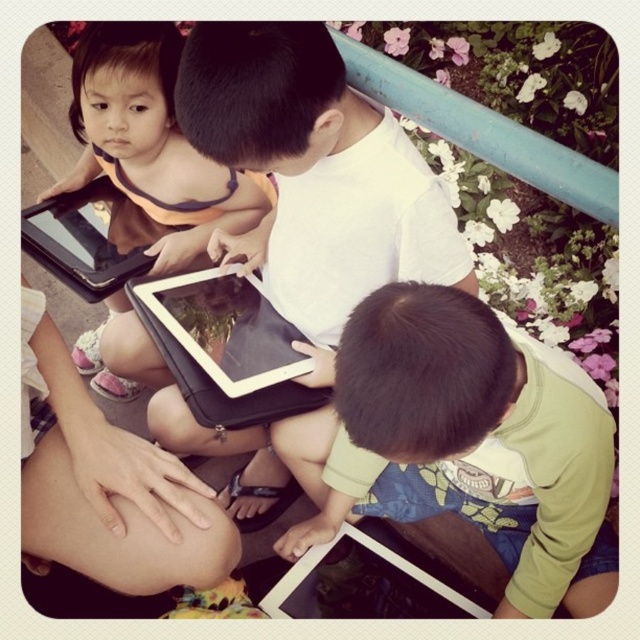
Who is lower down, green matte shirt at lower right or black matte tablet at upper left?

Positioned lower is green matte shirt at lower right.

Which is above, green matte shirt at lower right or black matte tablet at upper left?

Positioned higher is black matte tablet at upper left.

Does point (314, 492) come farther from viewer compared to point (100, 292)?

That is True.

The height and width of the screenshot is (640, 640). Find the location of `green matte shirt at lower right`. green matte shirt at lower right is located at coordinates (474, 440).

Looking at this image, is green matte shirt at lower right in front of matte black tablet at upper left?

Yes, it is in front of matte black tablet at upper left.

Who is positioned more to the left, green matte shirt at lower right or matte black tablet at upper left?

Positioned to the left is matte black tablet at upper left.

The image size is (640, 640). Identify the location of green matte shirt at lower right. (474, 440).

You are a GUI agent. You are given a task and a screenshot of the screen. Output one action in this format:
    pyautogui.click(x=<x>, y=<y>)
    Task: Click on the green matte shirt at lower right
    Image resolution: width=640 pixels, height=640 pixels.
    Given the screenshot: What is the action you would take?
    pyautogui.click(x=474, y=440)

Does white matte tablet at center have a lesser width compared to black matte tablet at upper left?

Incorrect, white matte tablet at center's width is not less than black matte tablet at upper left's.

Is white matte tablet at center smaller than black matte tablet at upper left?

No.

Describe the element at coordinates (314, 172) in the screenshot. I see `white matte tablet at center` at that location.

You are a GUI agent. You are given a task and a screenshot of the screen. Output one action in this format:
    pyautogui.click(x=<x>, y=<y>)
    Task: Click on the white matte tablet at center
    
    Given the screenshot: What is the action you would take?
    pyautogui.click(x=314, y=172)